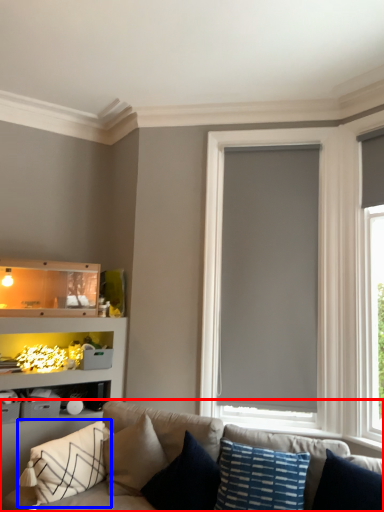
Question: Which point is further to the camera, studio couch (highlighted by a red box) or pillow (highlighted by a blue box)?

Choices:
 (A) studio couch
 (B) pillow

Answer: (B)